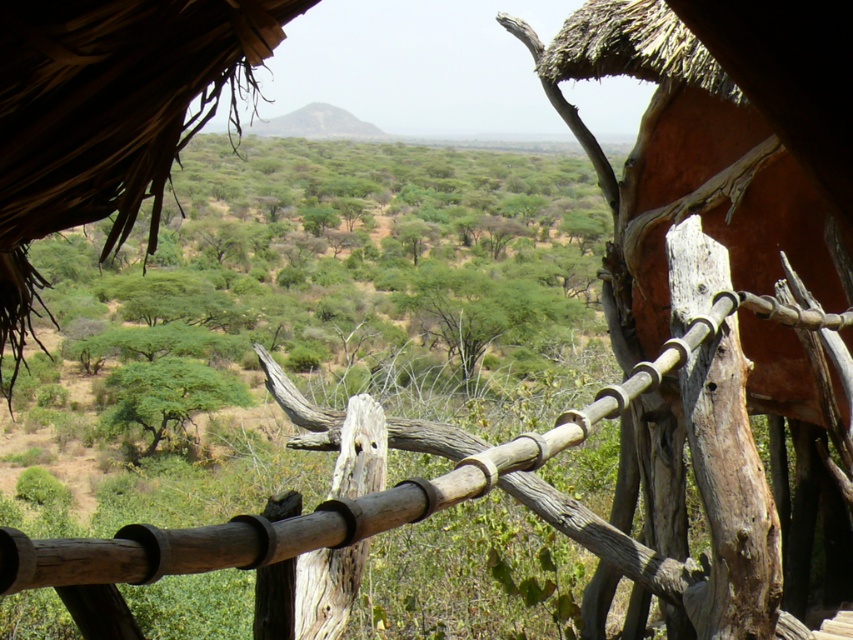
You are standing at the rustic structure overlooking the savanna. You see a brown wooden fence at center and a green leafy tree at center. Which object is positioned to the right of the other?

The brown wooden fence at center is to the right of the green leafy tree at center.